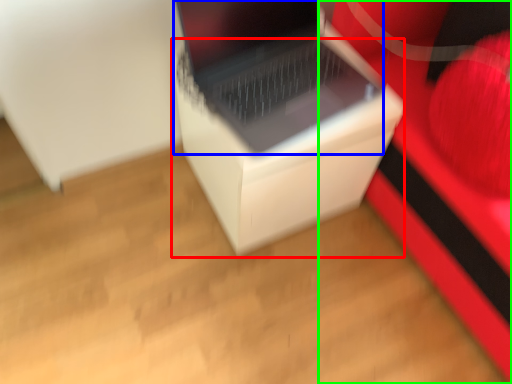
Question: Based on their relative distances, which object is farther from cardboard box (highlighted by a red box)? Choose from laptop (highlighted by a blue box) and furniture (highlighted by a green box).

Choices:
 (A) laptop
 (B) furniture

Answer: (B)